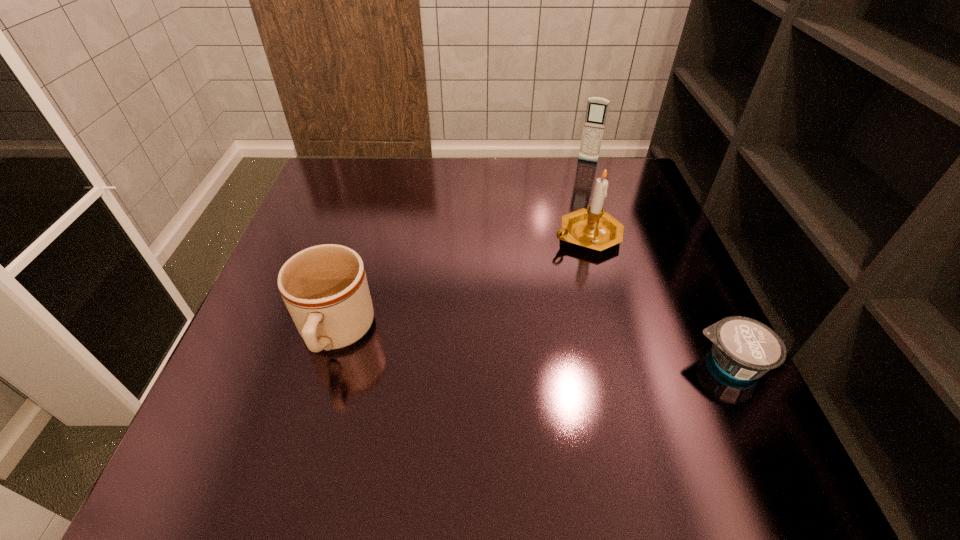
Locate an element on the screen. The image size is (960, 540). free space located 0.400m with a handle on the second farthest object is located at coordinates (457, 367).

Where is `free location located 0.080m on the front-facing side of the farthest object`? free location located 0.080m on the front-facing side of the farthest object is located at coordinates (581, 179).

Where is `vacant space situated on the front-facing side of the farthest object`? The image size is (960, 540). vacant space situated on the front-facing side of the farthest object is located at coordinates (576, 190).

Where is `vacant space located on the front-facing side of the farthest object`? The height and width of the screenshot is (540, 960). vacant space located on the front-facing side of the farthest object is located at coordinates (557, 244).

Locate an element on the screen. The height and width of the screenshot is (540, 960). object at the far edge is located at coordinates (597, 108).

At what (x,y) coordinates should I click in order to perform the action: click on mug at the near edge. Please return your answer as a coordinate pair (x, y). Looking at the image, I should click on 325,289.

Identify the location of yogurt located at the near edge. (743, 348).

Image resolution: width=960 pixels, height=540 pixels. Identify the location of object that is at the left edge. (x=325, y=289).

Find the location of a particular element. yogurt present at the right edge is located at coordinates (743, 348).

The height and width of the screenshot is (540, 960). Find the location of `candle holder present at the right edge`. candle holder present at the right edge is located at coordinates (593, 228).